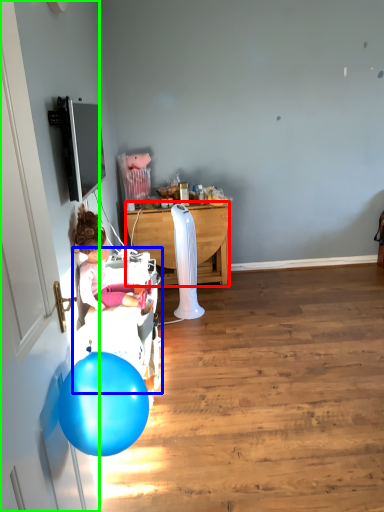
Question: Which is nearer to the desk (highlighted by a red box)? baby carriage (highlighted by a blue box) or door (highlighted by a green box).

Choices:
 (A) baby carriage
 (B) door

Answer: (A)